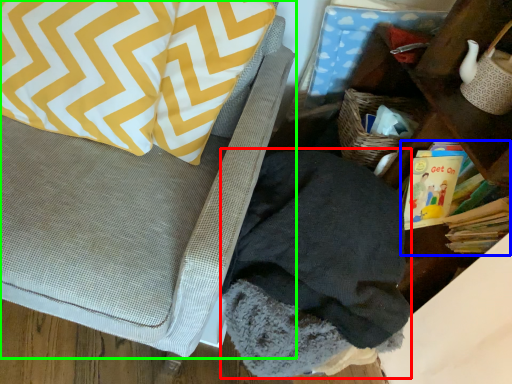
Question: Which is farther away from clothing (highlighted by a red box)? book (highlighted by a blue box) or furniture (highlighted by a green box)?

Choices:
 (A) book
 (B) furniture

Answer: (A)